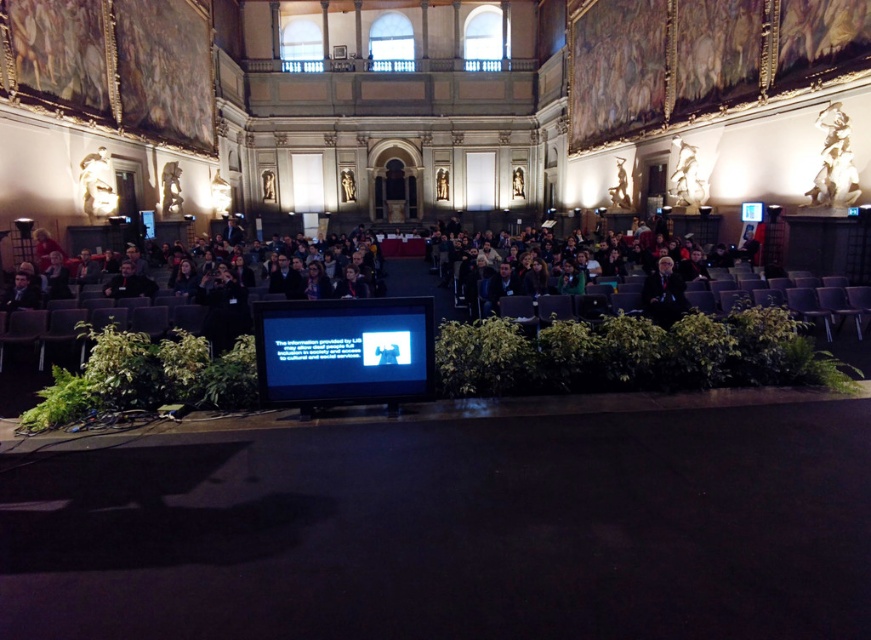
You are standing in the center of the hall and notice a point marked at coordinates (343,349). What object is this point located on?

The point at coordinates (343,349) is located on the matte black screen at center.

You are attending a lecture in the hall and want to see both the matte black screen at center and the dark blue suit at center. Which object is closer to you?

The matte black screen at center is closer to the viewer than the dark blue suit at center.

You are standing at the entrance of the hall and want to read the text displayed on the matte black screen at center. Given that the average comfortable reading distance for a person with normal vision is 1.5 meters, can you comfortably read the text from your current position?

The matte black screen at center is 19.72 meters away from the viewer, which is much farther than the average comfortable reading distance of 1.5 meters. Therefore, you cannot comfortably read the text from your current position.